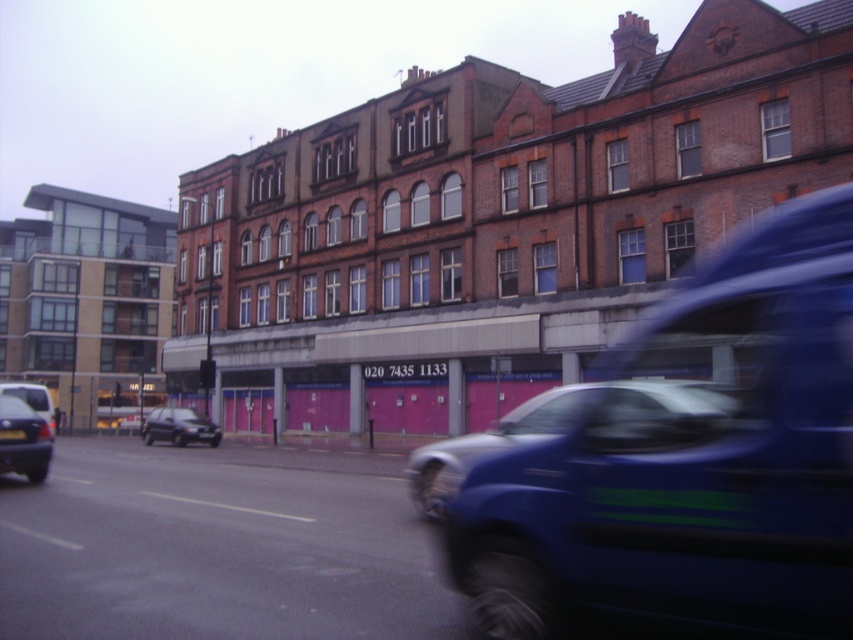
You are a delivery person who needs to park your black metallic car at lower left near the black plastic license plate at center. Can you safely park your car without hitting the license plate?

The distance between the black metallic car at lower left and the black plastic license plate at center is 14.08 inches, which is too close for safe parking. You should move the black metallic car at lower left further away to avoid collision.

You are a pedestrian standing on the sidewalk and see the matte black van at left and the black plastic license plate at center. Which object is closer to the left side of the road?

The matte black van at left is closer to the left side of the road because it is positioned to the left of the black plastic license plate at center.

You are standing on the road in the urban street scene. You see two points marked on the ground. The first point is at coordinate point (44,448) and the second point is at coordinate point (1,433). Which point is closer to you?

Point (1,433) is closer to you because point (44,448) is behind it.